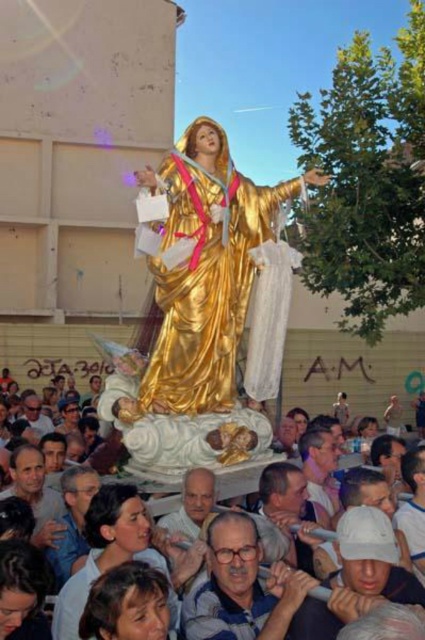
Question: Estimate the real-world distances between objects in this image. Which object is farther from the white marble crowd at center?

Choices:
 (A) white matte baseball cap at center
 (B) matte blue shirt at center
 (C) smooth skin face at lower left

Answer: (C)

Question: Is white matte baseball cap at center further to the viewer compared to smooth skin face at lower left?

Choices:
 (A) no
 (B) yes

Answer: (A)

Question: Is smooth skin face at lower left bigger than white marble crowd at center?

Choices:
 (A) yes
 (B) no

Answer: (B)

Question: Which object appears farthest from the camera in this image?

Choices:
 (A) white matte baseball cap at center
 (B) gold polished statue at center

Answer: (B)

Question: Among these points, which one is nearest to the camera?

Choices:
 (A) (197, 376)
 (B) (34, 460)
 (C) (376, 564)
 (D) (411, 580)

Answer: (C)

Question: Observing the image, what is the correct spatial positioning of white matte baseball cap at center in reference to smooth skin face at lower left?

Choices:
 (A) below
 (B) above

Answer: (A)